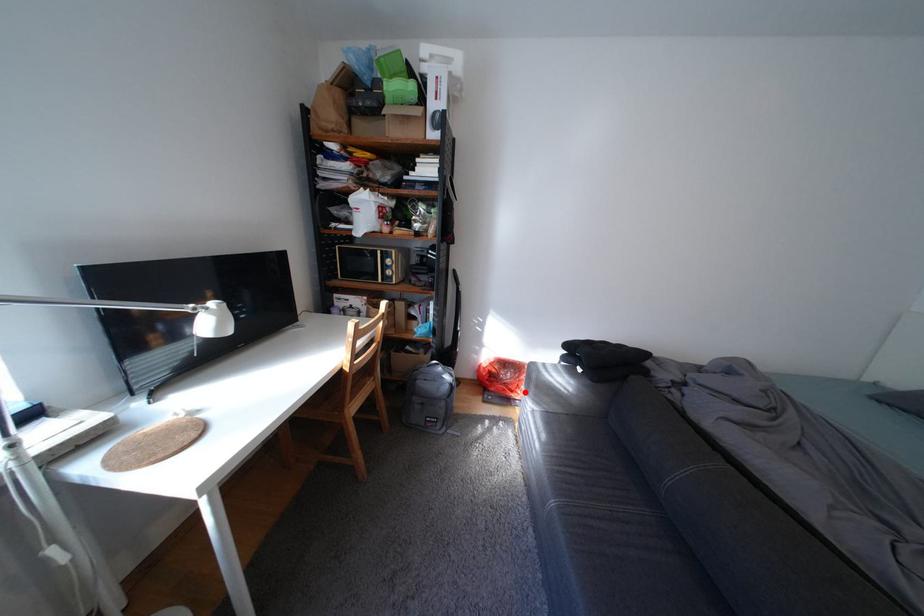
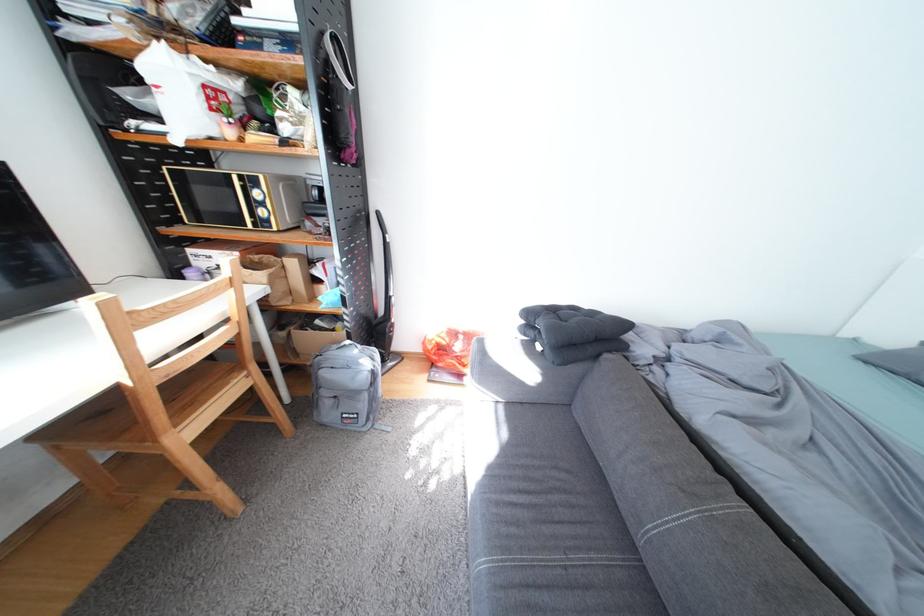
Question: I am providing you with two images of the same scene from different viewpoints. Given a red point in image1, look at the same physical point in image2. Is it:

Choices:
 (A) Closer to the viewpoint
 (B) Farther from the viewpoint

Answer: (B)